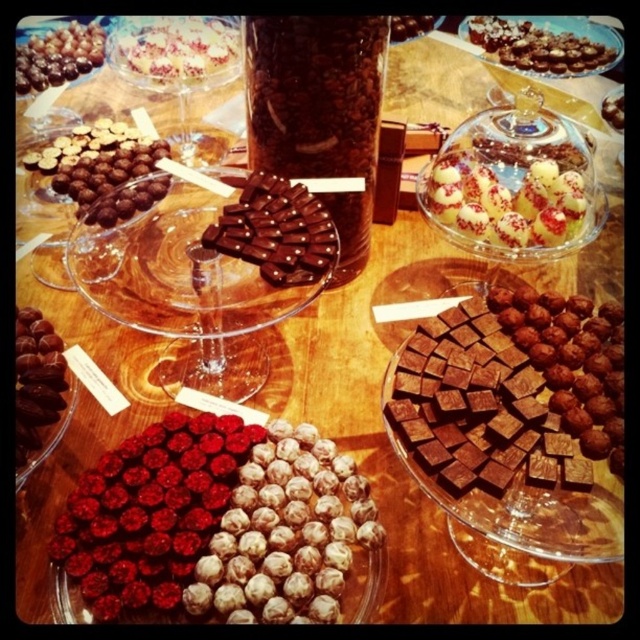
Does chocolate matte at center have a greater width compared to shiny chocolate truffles at upper center?

Incorrect, chocolate matte at center's width does not surpass shiny chocolate truffles at upper center's.

Which is behind, point (314, 234) or point (545, 56)?

The point (545, 56) is more distant.

At what (x,y) coordinates should I click in order to perform the action: click on chocolate matte at center. Please return your answer as a coordinate pair (x, y). Looking at the image, I should click on (275, 230).

Find the location of a particular element. The image size is (640, 640). dark chocolate cubes at center is located at coordinates (512, 388).

Is dark chocolate cubes at center to the right of chocolate matte at center from the viewer's perspective?

Answer: Indeed, dark chocolate cubes at center is positioned on the right side of chocolate matte at center.

Who is more distant from viewer, (408, 408) or (305, 188)?

Point (305, 188)

The image size is (640, 640). Find the location of `dark chocolate cubes at center`. dark chocolate cubes at center is located at coordinates (512, 388).

Who is more forward, (269, 225) or (42, 387)?

Point (42, 387) is more forward.

Find the location of a particular element. This screenshot has height=640, width=640. chocolate matte at center is located at coordinates (275, 230).